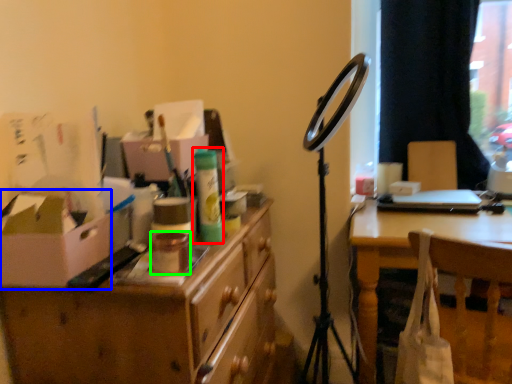
Question: Estimate the real-world distances between objects in this image. Which object is closer to toiletry (highlighted by a red box), cardboard box (highlighted by a blue box) or toiletry (highlighted by a green box)?

Choices:
 (A) cardboard box
 (B) toiletry

Answer: (B)